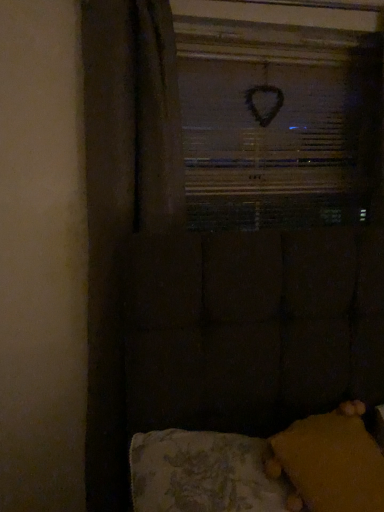
Question: Is yellow fuzzy pillow at lower right directly adjacent to velvet yellow cushion at lower right?

Choices:
 (A) yes
 (B) no

Answer: (A)

Question: Would you say yellow fuzzy pillow at lower right contains velvet yellow cushion at lower right?

Choices:
 (A) no
 (B) yes

Answer: (B)

Question: Is yellow fuzzy pillow at lower right positioned with its back to velvet yellow cushion at lower right?

Choices:
 (A) yes
 (B) no

Answer: (A)

Question: Could you tell me if yellow fuzzy pillow at lower right is facing velvet yellow cushion at lower right?

Choices:
 (A) yes
 (B) no

Answer: (A)

Question: Considering the relative positions of yellow fuzzy pillow at lower right and velvet yellow cushion at lower right in the image provided, is yellow fuzzy pillow at lower right to the left of velvet yellow cushion at lower right from the viewer's perspective?

Choices:
 (A) yes
 (B) no

Answer: (B)

Question: Is yellow fuzzy pillow at lower right taller or shorter than black matte heart at upper center?

Choices:
 (A) short
 (B) tall

Answer: (A)

Question: Is yellow fuzzy pillow at lower right bigger or smaller than black matte heart at upper center?

Choices:
 (A) small
 (B) big

Answer: (A)

Question: From the image's perspective, is yellow fuzzy pillow at lower right located above or below black matte heart at upper center?

Choices:
 (A) below
 (B) above

Answer: (A)

Question: Is yellow fuzzy pillow at lower right in front of or behind black matte heart at upper center in the image?

Choices:
 (A) behind
 (B) front

Answer: (B)

Question: From a real-world perspective, is black matte heart at upper center positioned above or below velvet yellow cushion at lower right?

Choices:
 (A) below
 (B) above

Answer: (B)

Question: From the image's perspective, is black matte heart at upper center located above or below velvet yellow cushion at lower right?

Choices:
 (A) below
 (B) above

Answer: (B)

Question: In terms of width, does black matte heart at upper center look wider or thinner when compared to velvet yellow cushion at lower right?

Choices:
 (A) wide
 (B) thin

Answer: (B)

Question: Considering the positions of point (370, 41) and point (261, 442), is point (370, 41) closer or farther from the camera than point (261, 442)?

Choices:
 (A) closer
 (B) farther

Answer: (B)

Question: From the image's perspective, is yellow fuzzy pillow at lower right positioned above or below velvet yellow cushion at lower right?

Choices:
 (A) below
 (B) above

Answer: (B)

Question: Visually, is yellow fuzzy pillow at lower right positioned to the left or to the right of velvet yellow cushion at lower right?

Choices:
 (A) right
 (B) left

Answer: (A)